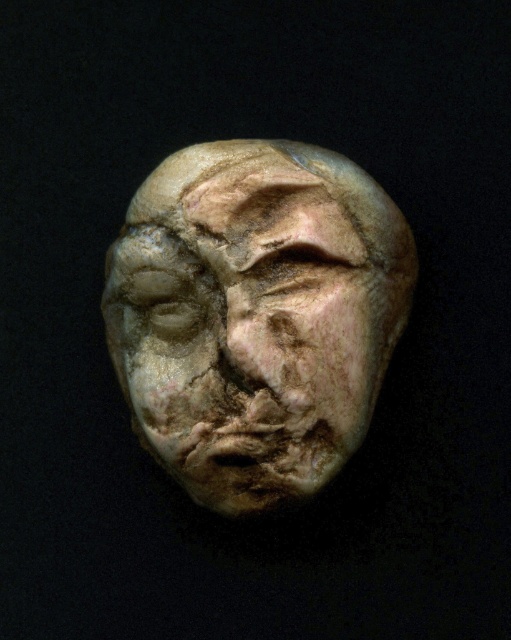
You are an archaeologist examining the sculpture. You notice two parts of the sculpture labeled as the matte stone face at center and the matte stone forehead at upper center. Which part is closer to your viewpoint?

The matte stone face at center is closer to your viewpoint because it is in front of the matte stone forehead at upper center.

You are an archaeologist examining a sculpture. You notice the matte stone face at center. Where is it positioned in the image?

The matte stone face at center is positioned at the center of the image, specifically at coordinates approximately 0.494 on the x axis and 0.501 on the y axis.

You are an archaeologist examining the ancient sculpture. You notice two points on the sculpture labeled as point 1 at coordinates point [269,355] and point 2 at coordinates point [357,236]. Which point is closer to your viewpoint?

Point [269,355] is closer to the camera than point [357,236].